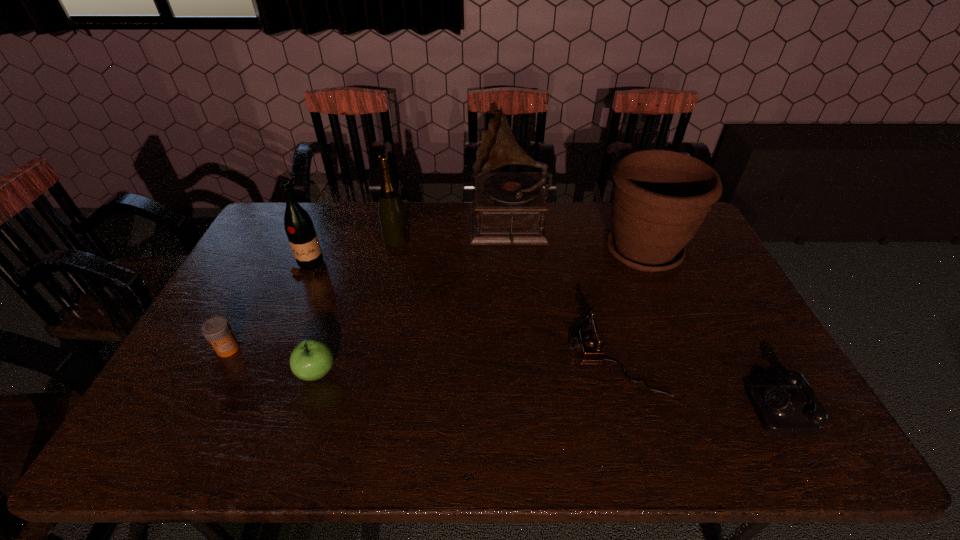
This screenshot has height=540, width=960. I want to click on vacant area situated 0.340m from the horn of the record player, so click(377, 226).

The image size is (960, 540). Identify the location of vacant space located 0.100m from the horn of the record player. (444, 226).

Identify the location of free point located from the horn of the record player. (377, 226).

You are a GUI agent. You are given a task and a screenshot of the screen. Output one action in this format:
    pyautogui.click(x=<x>, y=<y>)
    Task: Click on the free space located 0.180m on the front-facing side of the farther wine bottle
    
    Given the screenshot: What is the action you would take?
    pyautogui.click(x=461, y=240)

Image resolution: width=960 pixels, height=540 pixels. I want to click on free location located 0.170m on the left of the flowerpot, so pyautogui.click(x=547, y=251).

Locate an element on the screen. This screenshot has height=540, width=960. vacant position located on the surface of the seventh object from right to left is located at coordinates (271, 365).

The image size is (960, 540). Identify the location of vacant space located on the dial of the left telephone. (450, 359).

Locate an element on the screen. vacant region located 0.320m on the dial of the left telephone is located at coordinates (450, 359).

Locate an element on the screen. free location located on the dial of the left telephone is located at coordinates (548, 359).

Identify the location of free space located on the back of the third object from left to right. The height and width of the screenshot is (540, 960). pos(353,259).